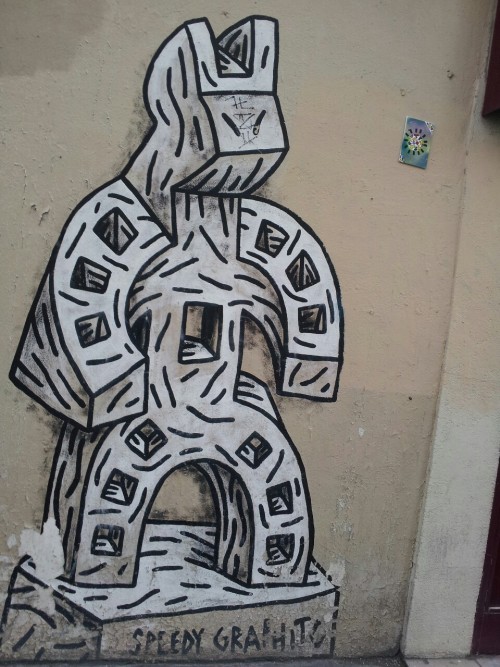
I want to click on iridescent plate, so 419,151.